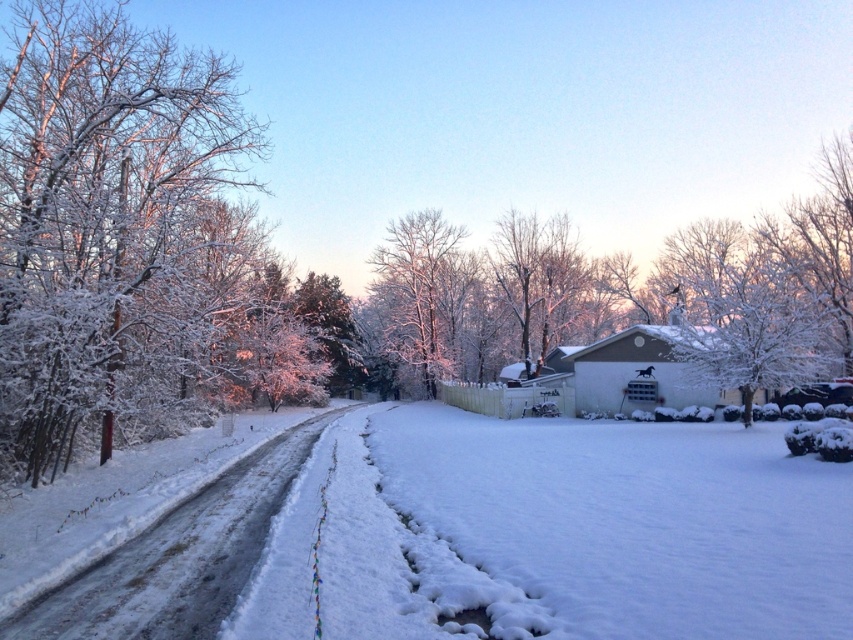
Where is `white fluffy snow at center`? white fluffy snow at center is located at coordinates (492, 538).

I want to click on white fluffy snow at center, so click(492, 538).

Who is positioned more to the right, white fluffy snow at center or white frosty tree at center?

From the viewer's perspective, white fluffy snow at center appears more on the right side.

Who is more distant from viewer, (601, 570) or (440, 232)?

Point (440, 232)

Where is `white fluffy snow at center`? The width and height of the screenshot is (853, 640). white fluffy snow at center is located at coordinates (492, 538).

Consider the image. Who is more forward, (x=26, y=3) or (x=340, y=348)?

Point (x=26, y=3) is in front.

Can you confirm if white frosty branches at left is taller than glistening snow-covered evergreen at center?

Yes, white frosty branches at left is taller than glistening snow-covered evergreen at center.

What do you see at coordinates (105, 221) in the screenshot?
I see `white frosty branches at left` at bounding box center [105, 221].

Find the location of a particular element. The image size is (853, 640). white frosty branches at left is located at coordinates (105, 221).